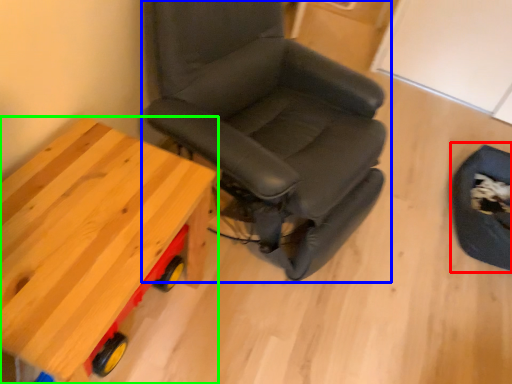
Question: Considering the real-world distances, which object is closest to swivel chair (highlighted by a red box)? chair (highlighted by a blue box) or table (highlighted by a green box).

Choices:
 (A) chair
 (B) table

Answer: (A)